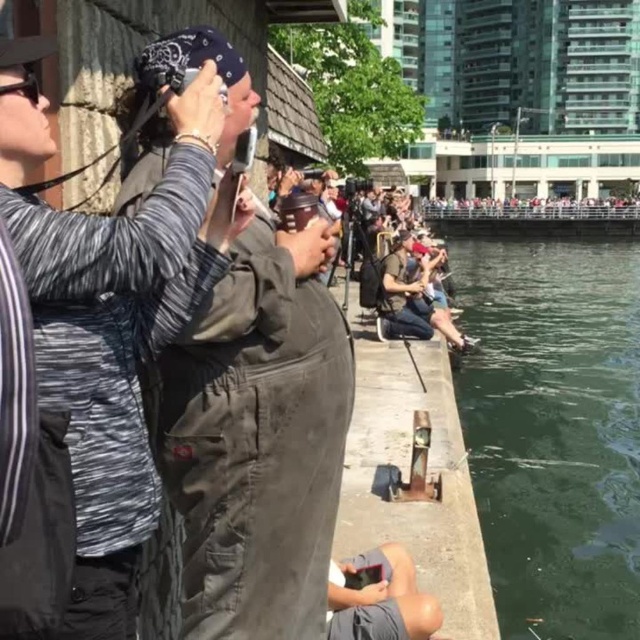
Question: Which point is farther from the camera taking this photo?

Choices:
 (A) (212, 333)
 (B) (381, 298)
 (C) (132, 596)

Answer: (B)

Question: Does camouflage-patterned jacket at center lie in front of green concrete river at lower right?

Choices:
 (A) no
 (B) yes

Answer: (B)

Question: Does dark gray fabric at center have a larger size compared to green concrete river at lower right?

Choices:
 (A) yes
 (B) no

Answer: (B)

Question: Estimate the real-world distances between objects in this image. Which object is farther from the green concrete river at lower right?

Choices:
 (A) gray fabric shorts at lower center
 (B) matte gray jacket at center
 (C) dark gray fabric at center
 (D) camouflage-patterned jacket at center

Answer: (D)

Question: In this image, where is green concrete river at lower right located relative to gray fabric shorts at lower center?

Choices:
 (A) below
 (B) above

Answer: (B)

Question: Which point is closer to the camera taking this photo?

Choices:
 (A) (140, 433)
 (B) (404, 264)
 (C) (426, 596)
 (D) (250, 252)

Answer: (A)